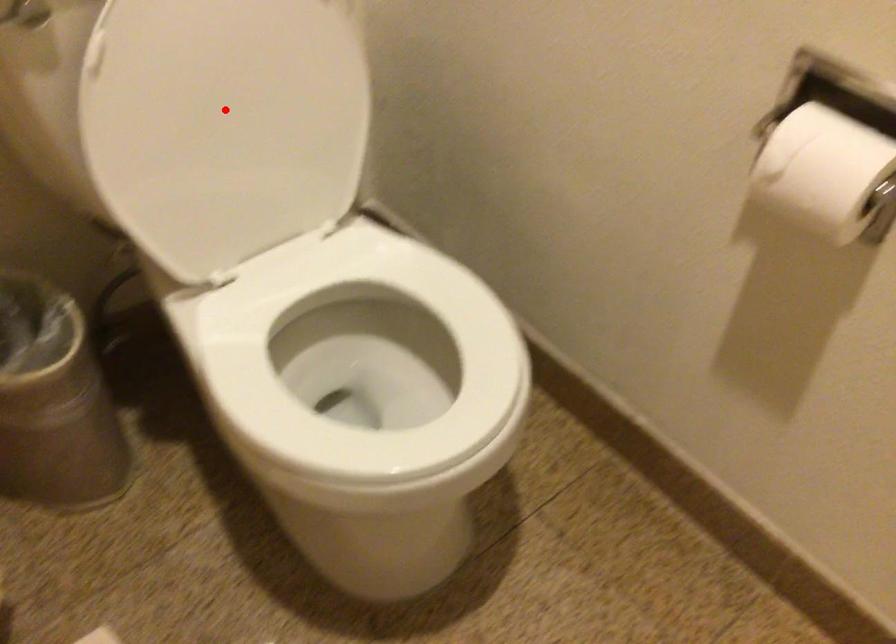
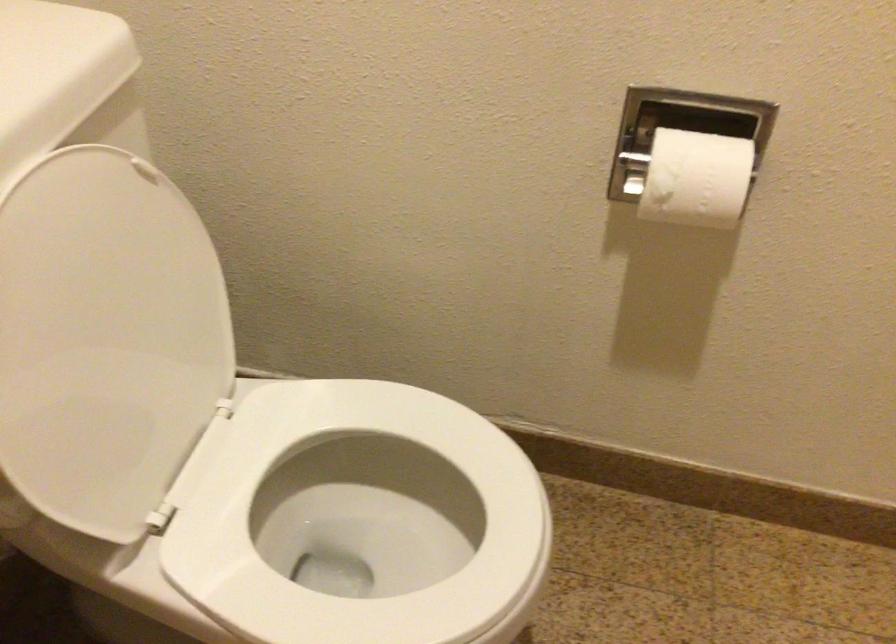
Find the pixel in the second image that matches the highlighted location in the first image.

(105, 339)